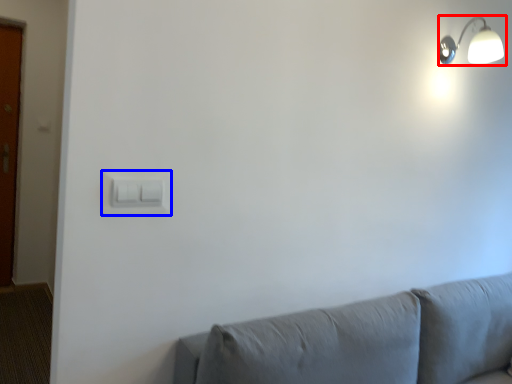
Question: Which object appears closest to the camera in this image, lamp (highlighted by a red box) or light switch (highlighted by a blue box)?

Choices:
 (A) lamp
 (B) light switch

Answer: (B)